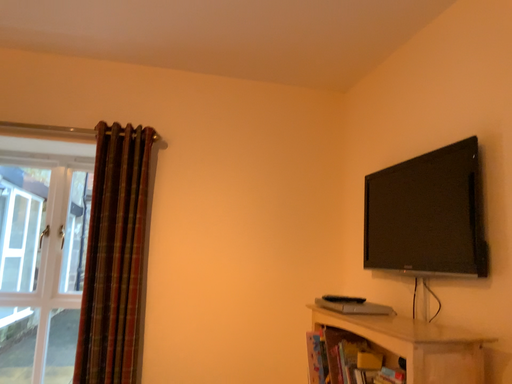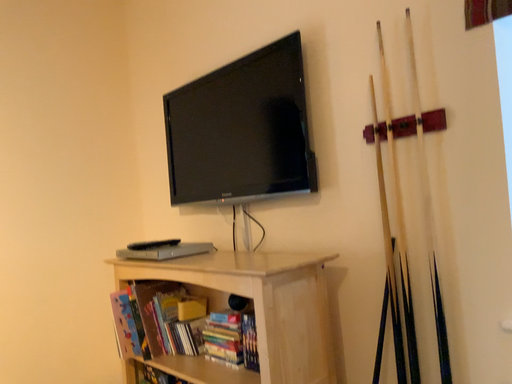
Question: How did the camera likely rotate when shooting the video?

Choices:
 (A) rotated right
 (B) rotated left

Answer: (A)